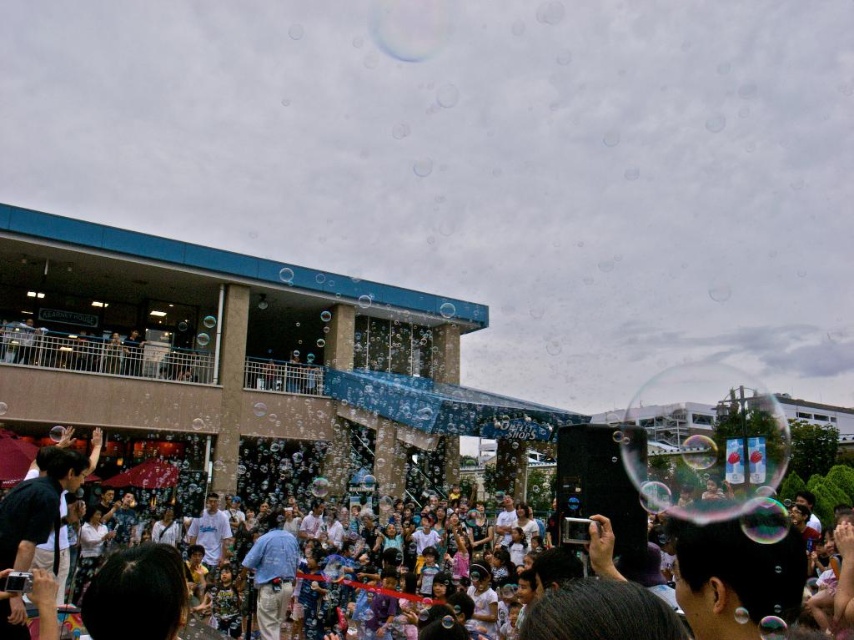
Question: Does white cotton shirt at center appear under blue denim jeans at center?

Choices:
 (A) no
 (B) yes

Answer: (A)

Question: Can you confirm if white cotton shirt at center is positioned below blue denim jeans at center?

Choices:
 (A) yes
 (B) no

Answer: (B)

Question: Which point is closer to the camera?

Choices:
 (A) (600, 637)
 (B) (276, 554)

Answer: (A)

Question: Can you confirm if white cotton shirt at center is positioned below blue denim jeans at center?

Choices:
 (A) yes
 (B) no

Answer: (B)

Question: Which point is farther to the camera?

Choices:
 (A) (736, 621)
 (B) (284, 596)

Answer: (B)